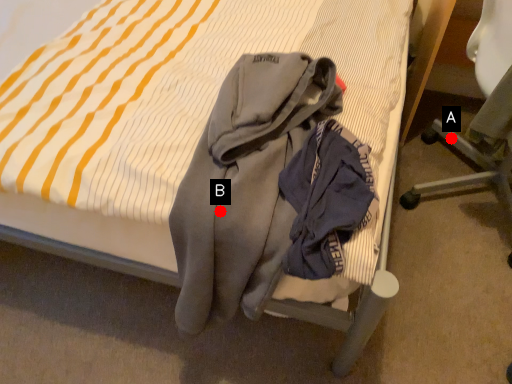
Question: Two points are circled on the image, labeled by A and B beside each circle. Which point appears closest to the camera in this image?

Choices:
 (A) A is closer
 (B) B is closer

Answer: (B)